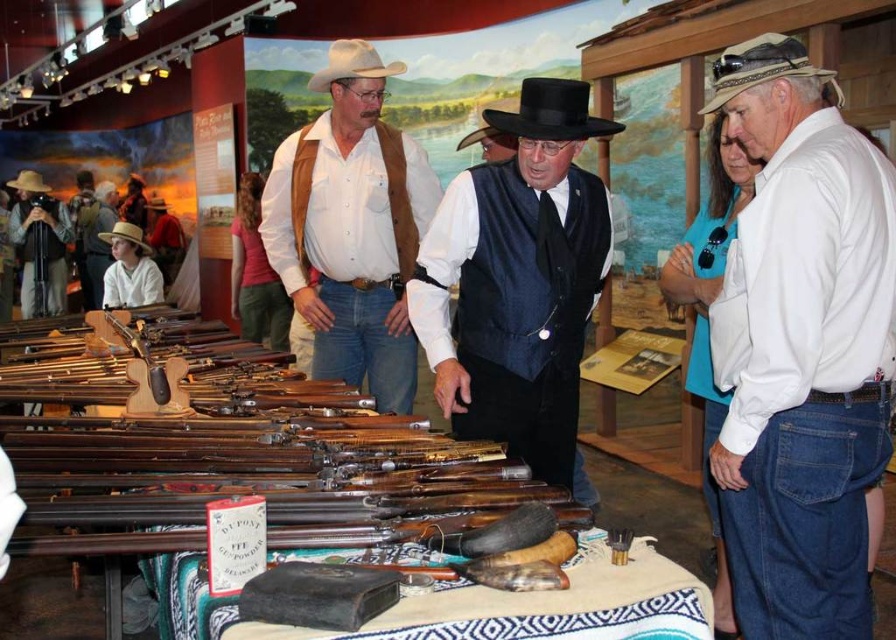
Question: Is the position of matte brown vest at center more distant than that of brown felt cowboy hat at upper left?

Choices:
 (A) no
 (B) yes

Answer: (A)

Question: Which is farther from the light brown straw cowboy hat at lower left?

Choices:
 (A) velvet black vest at center
 (B) brown felt cowboy hat at upper left
 (C) tan fabric cowboy hat at upper right

Answer: (C)

Question: Does white cotton shirt at upper right come behind light brown straw cowboy hat at lower left?

Choices:
 (A) yes
 (B) no

Answer: (B)

Question: Which point is closer to the camera?

Choices:
 (A) white felt cowboy hat at upper center
 (B) tan fabric cowboy hat at upper right
 (C) matte brown vest at center

Answer: (B)

Question: Is tan fabric cowboy hat at upper right bigger than brown felt cowboy hat at upper left?

Choices:
 (A) yes
 (B) no

Answer: (B)

Question: Among these objects, which one is farthest from the camera?

Choices:
 (A) brown leather cowboy hat at upper left
 (B) tan fabric cowboy hat at upper right

Answer: (A)